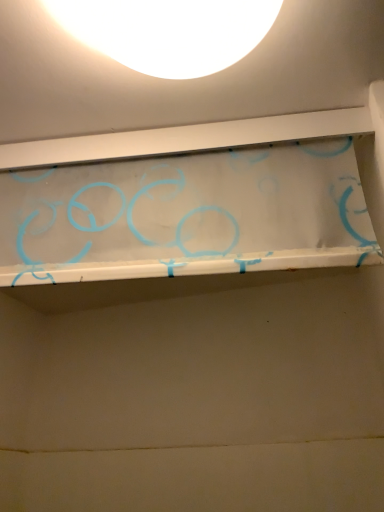
Question: Does transparent plastic shelf at upper center have a greater height compared to white matte lampshade at upper center?

Choices:
 (A) yes
 (B) no

Answer: (A)

Question: Is transparent plastic shelf at upper center bigger than white matte lampshade at upper center?

Choices:
 (A) no
 (B) yes

Answer: (B)

Question: Is transparent plastic shelf at upper center at the right side of white matte lampshade at upper center?

Choices:
 (A) no
 (B) yes

Answer: (A)

Question: Is transparent plastic shelf at upper center in contact with white matte lampshade at upper center?

Choices:
 (A) yes
 (B) no

Answer: (B)

Question: Is transparent plastic shelf at upper center outside of white matte lampshade at upper center?

Choices:
 (A) yes
 (B) no

Answer: (A)

Question: Can you confirm if transparent plastic shelf at upper center is positioned to the left of white matte lampshade at upper center?

Choices:
 (A) yes
 (B) no

Answer: (A)

Question: From the image's perspective, is white matte lampshade at upper center located beneath transparent plastic shelf at upper center?

Choices:
 (A) yes
 (B) no

Answer: (B)

Question: Does white matte lampshade at upper center have a smaller size compared to transparent plastic shelf at upper center?

Choices:
 (A) no
 (B) yes

Answer: (B)

Question: Considering the relative sizes of white matte lampshade at upper center and transparent plastic shelf at upper center in the image provided, is white matte lampshade at upper center taller than transparent plastic shelf at upper center?

Choices:
 (A) yes
 (B) no

Answer: (B)

Question: From a real-world perspective, is white matte lampshade at upper center under transparent plastic shelf at upper center?

Choices:
 (A) no
 (B) yes

Answer: (A)

Question: Is white matte lampshade at upper center further to the viewer compared to transparent plastic shelf at upper center?

Choices:
 (A) yes
 (B) no

Answer: (B)

Question: Are white matte lampshade at upper center and transparent plastic shelf at upper center located far from each other?

Choices:
 (A) yes
 (B) no

Answer: (B)

Question: Would you say white matte lampshade at upper center is inside or outside transparent plastic shelf at upper center?

Choices:
 (A) inside
 (B) outside

Answer: (B)